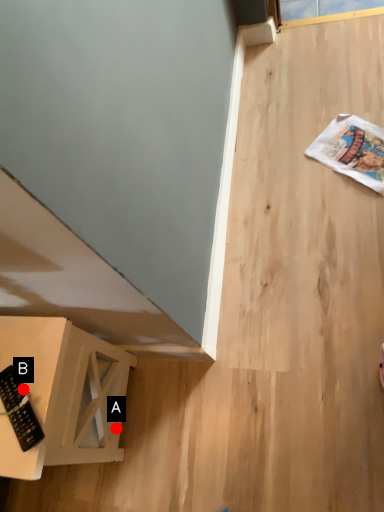
Question: Two points are circled on the image, labeled by A and B beside each circle. Among these points, which one is nearest to the camera?

Choices:
 (A) A is closer
 (B) B is closer

Answer: (B)